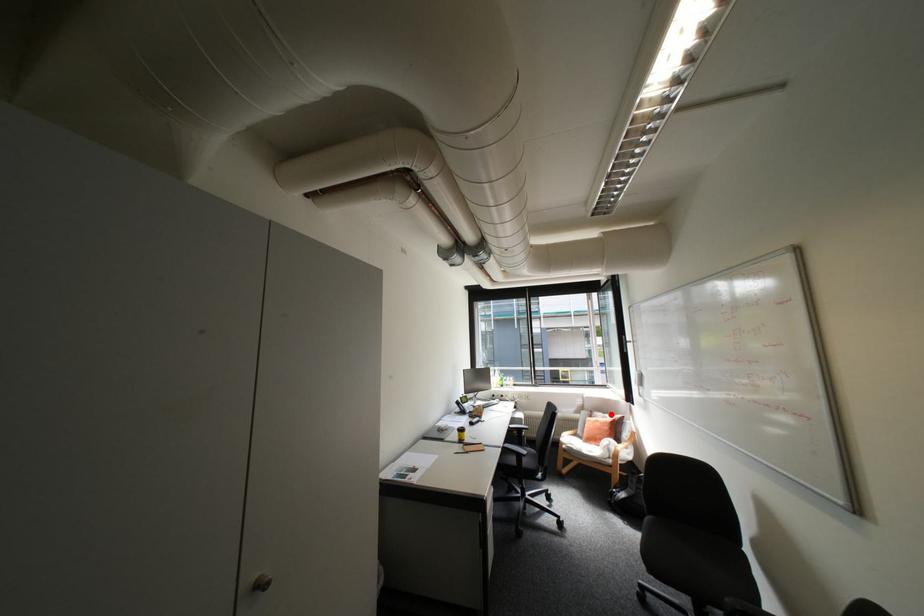
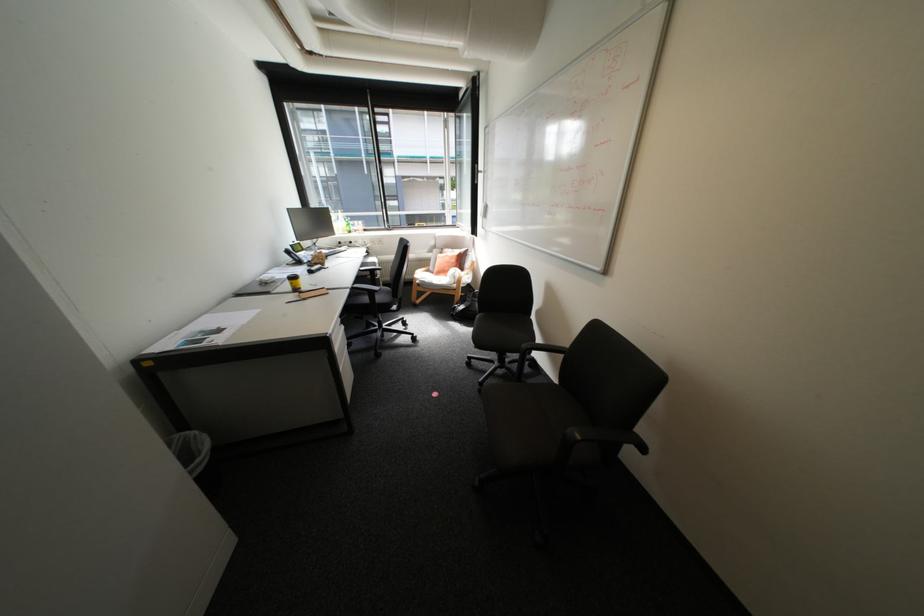
Question: I am providing you with two images of the same scene from different viewpoints. A red point is shown in image1. For the corresponding object point in image2, is it positioned nearer or farther from the camera?

Choices:
 (A) Nearer
 (B) Farther

Answer: (A)